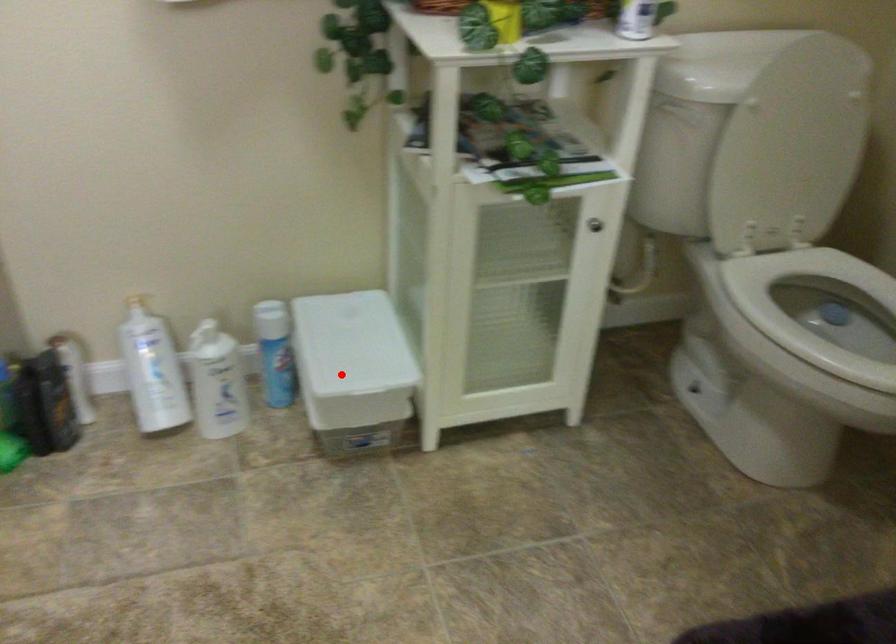
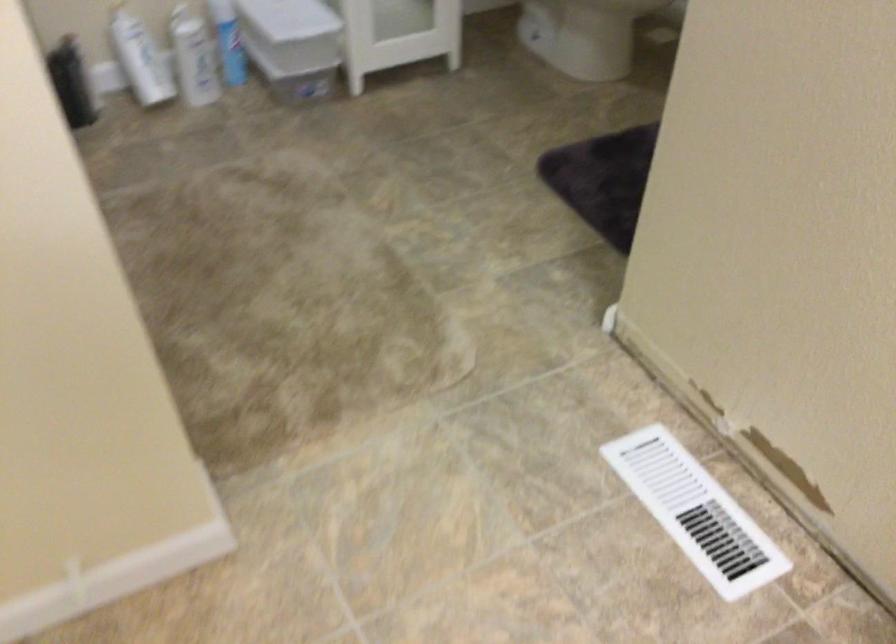
In the second image, find the point that corresponds to the highlighted location in the first image.

(293, 32)